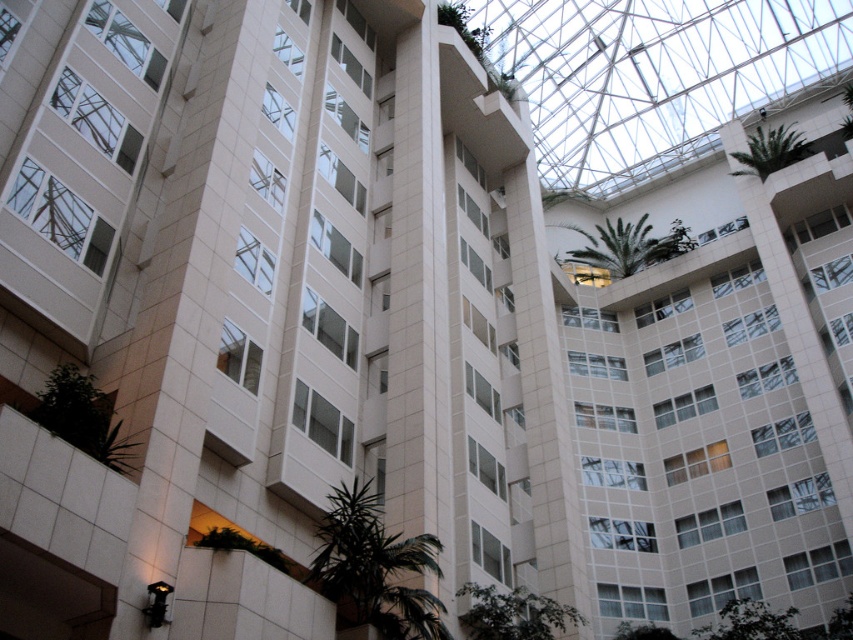
Question: Which point appears farthest from the camera in this image?

Choices:
 (A) (747, 168)
 (B) (627, 234)
 (C) (364, 499)

Answer: (B)

Question: Is green leafy palm tree at lower center positioned behind green leafy palm tree at upper right?

Choices:
 (A) yes
 (B) no

Answer: (B)

Question: Does green leafy palm tree at lower center have a larger size compared to green leafy palm tree at upper center?

Choices:
 (A) no
 (B) yes

Answer: (A)

Question: Among these points, which one is farthest from the camera?

Choices:
 (A) pos(672,256)
 (B) pos(410,618)

Answer: (A)

Question: Among these points, which one is nearest to the camera?

Choices:
 (A) (335, 500)
 (B) (766, 136)

Answer: (A)

Question: Does green leafy palm tree at lower center appear on the left side of green leafy palm tree at upper center?

Choices:
 (A) no
 (B) yes

Answer: (B)